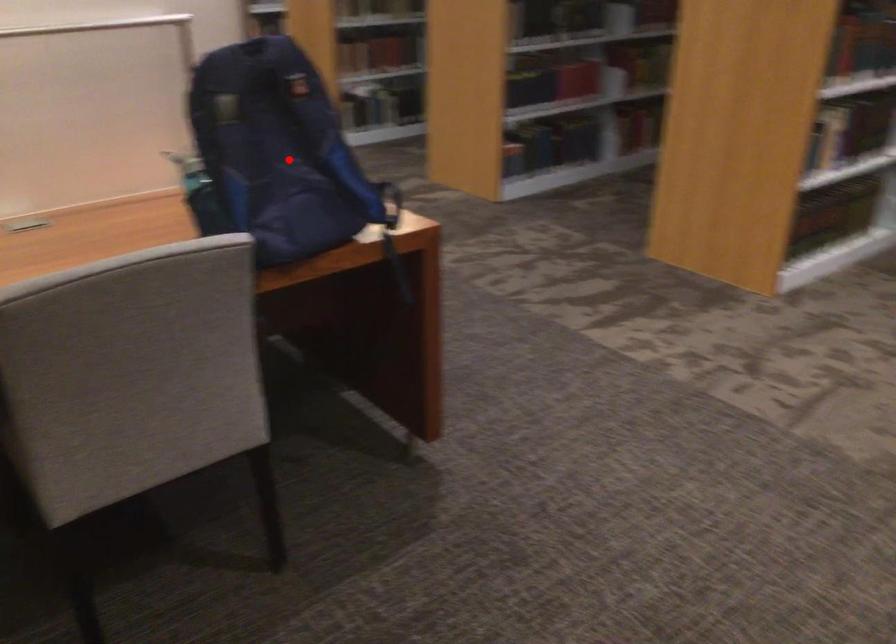
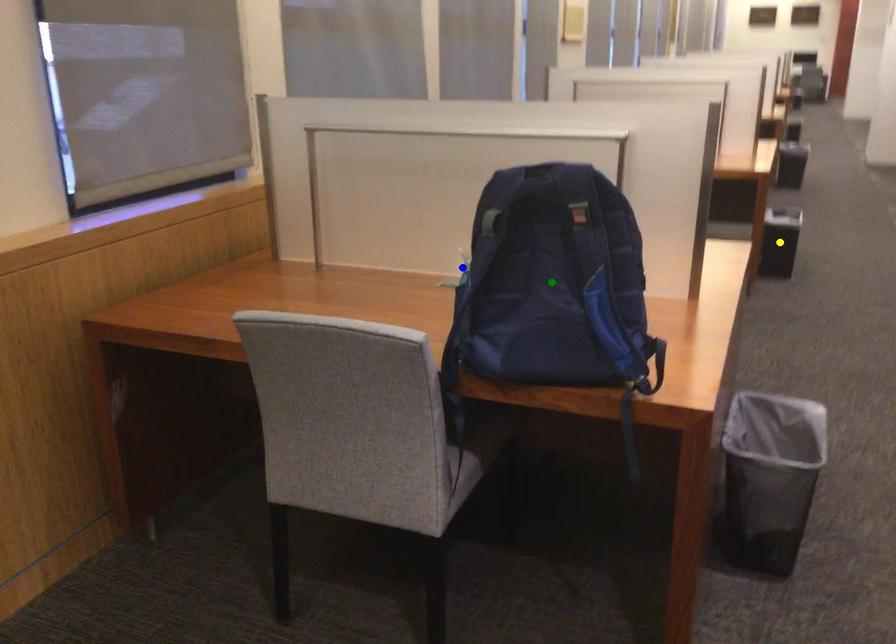
Question: I am providing you with two images of the same scene from different viewpoints. A red point is marked on the first image. You are given multiple points on the second image. In image 2, which mark is for the same physical point as the one in image 1?

Choices:
 (A) yellow point
 (B) green point
 (C) blue point

Answer: (B)